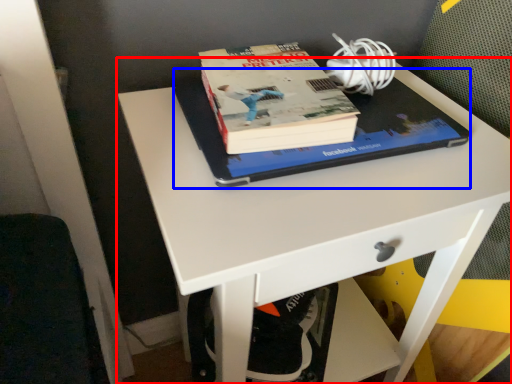
Question: Which object is closer to the camera taking this photo, desk (highlighted by a red box) or notebook (highlighted by a blue box)?

Choices:
 (A) desk
 (B) notebook

Answer: (A)